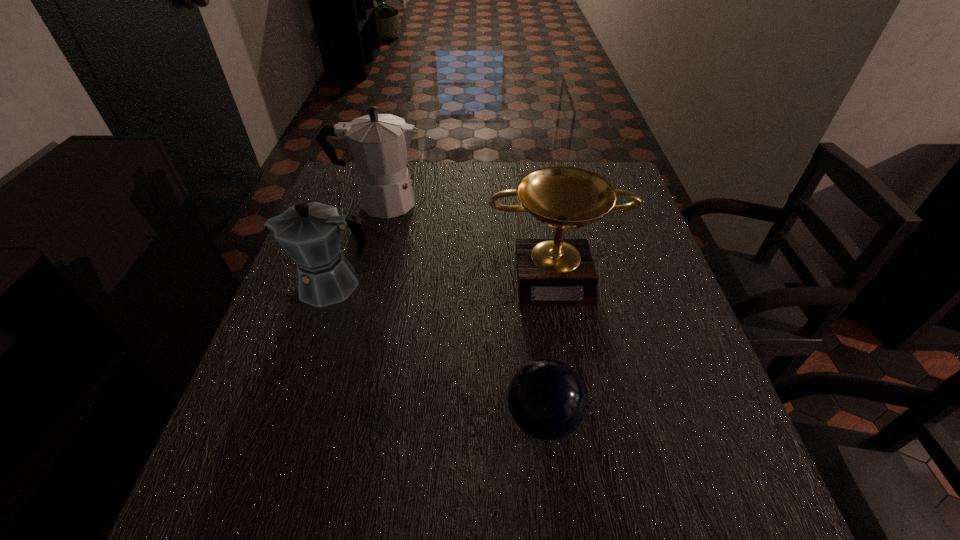
Where is `object that ranks as the closest to the award`? object that ranks as the closest to the award is located at coordinates (379, 143).

Choose which object is the third nearest neighbor to the shorter coffeepot. Please provide its 2D coordinates. Your answer should be formatted as a tuple, i.e. [(x, y)], where the tuple contains the x and y coordinates of a point satisfying the conditions above.

[(547, 400)]

This screenshot has height=540, width=960. I want to click on free space that satisfies the following two spatial constraints: 1. on the front-facing side of the award; 2. on the surface of the shortest object near the finger holes, so click(x=579, y=418).

Locate an element on the screen. vacant space that satisfies the following two spatial constraints: 1. on the front-facing side of the award; 2. on the surface of the bowling ball near the finger holes is located at coordinates 579,418.

At what (x,y) coordinates should I click in order to perform the action: click on blank space that satisfies the following two spatial constraints: 1. on the front-facing side of the award; 2. at the spout of the nearer coffeepot. Please return your answer as a coordinate pair (x, y). This screenshot has width=960, height=540. Looking at the image, I should click on (556, 284).

Locate an element on the screen. This screenshot has height=540, width=960. vacant position in the image that satisfies the following two spatial constraints: 1. on the front-facing side of the award; 2. at the spout of the shorter coffeepot is located at coordinates (556, 284).

You are a GUI agent. You are given a task and a screenshot of the screen. Output one action in this format:
    pyautogui.click(x=<x>, y=<y>)
    Task: Click on the vacant region that satisfies the following two spatial constraints: 1. on the front-facing side of the award; 2. at the spout of the nearer coffeepot
    
    Given the screenshot: What is the action you would take?
    pyautogui.click(x=556, y=284)